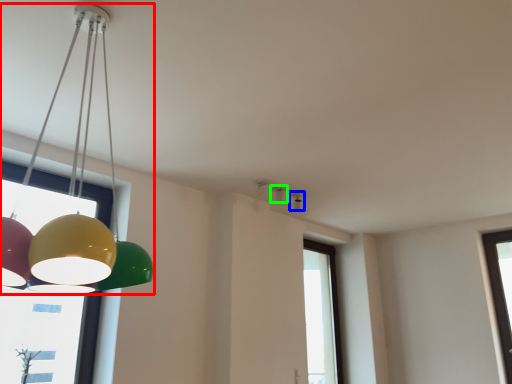
Question: Based on their relative distances, which object is farther from lamp (highlighted by a red box)? Choose from lamp (highlighted by a blue box) and lamp (highlighted by a green box).

Choices:
 (A) lamp
 (B) lamp

Answer: (A)